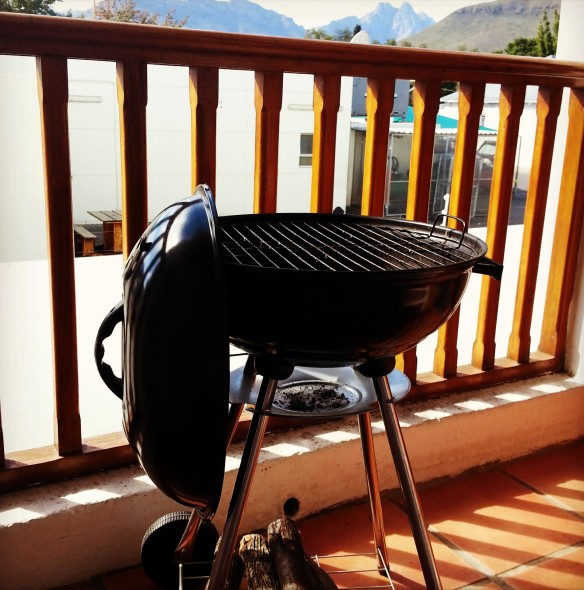
Locate an element on the screen. handle is located at coordinates (110, 327).